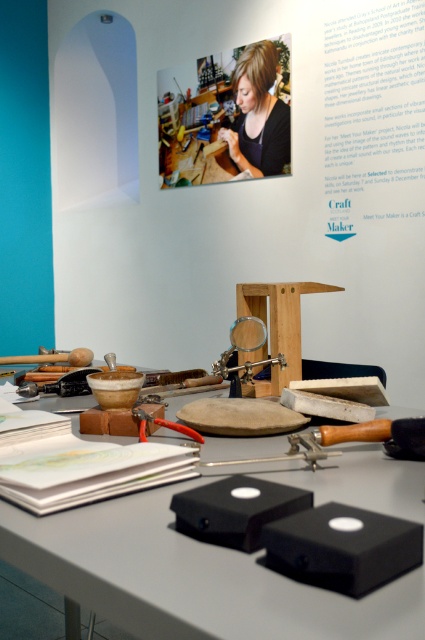
Can you confirm if black matte table at center is smaller than matte black shirt at upper center?

Incorrect, black matte table at center is not smaller in size than matte black shirt at upper center.

Which is behind, point (221, 620) or point (255, 166)?

Point (255, 166)

Locate an element on the screen. The image size is (425, 640). black matte table at center is located at coordinates (220, 561).

Is black matte table at center to the left of wooden stool at center from the viewer's perspective?

Correct, you'll find black matte table at center to the left of wooden stool at center.

Is black matte table at center smaller than wooden stool at center?

Actually, black matte table at center might be larger than wooden stool at center.

Who is more distant from viewer, [85,563] or [314,291]?

The point [314,291] is more distant.

Where is `black matte table at center`? Image resolution: width=425 pixels, height=640 pixels. black matte table at center is located at coordinates (220, 561).

Can you confirm if matte black shirt at upper center is smaller than wooden stool at center?

Actually, matte black shirt at upper center might be larger than wooden stool at center.

Does point (258, 161) come behind point (282, 300)?

Yes, point (258, 161) is farther from viewer.

Locate an element on the screen. This screenshot has height=640, width=425. matte black shirt at upper center is located at coordinates (257, 113).